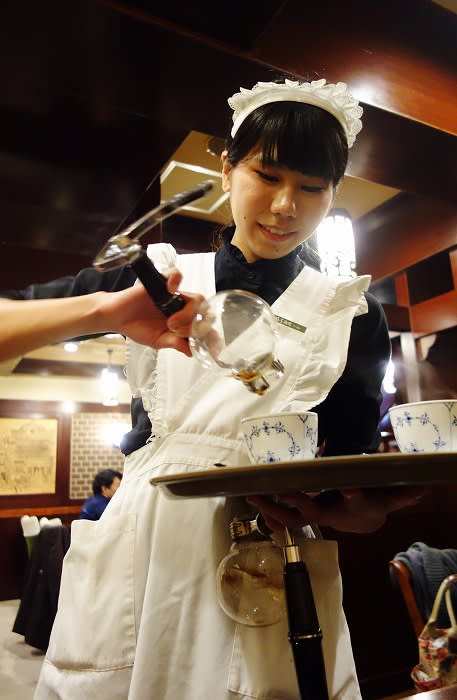
The height and width of the screenshot is (700, 457). Identify the location of glass ball. (230, 336).